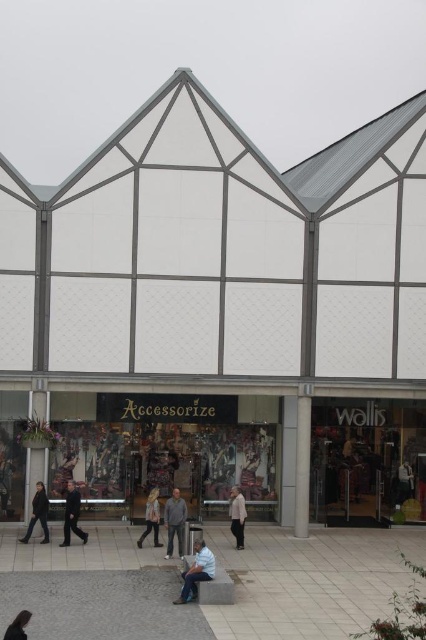
Question: Which point is closer to the camera?

Choices:
 (A) white matte mall at center
 (B) denim jeans at center
 (C) light brown leather jacket at center
 (D) gray cotton shirt at center

Answer: (B)

Question: Estimate the real-world distances between objects in this image. Which object is farther from the white matte mall at center?

Choices:
 (A) matte black clothing store at lower center
 (B) dark brown hair at upper left
 (C) dark brown leather jacket at lower left

Answer: (B)

Question: Can you confirm if matte black clothing store at lower center is wider than light brown leather jacket at center?

Choices:
 (A) no
 (B) yes

Answer: (B)

Question: Which point appears farthest from the camera in this image?

Choices:
 (A) (393, 429)
 (B) (157, 502)
 (C) (17, 621)
 (D) (166, 509)

Answer: (A)

Question: Is matte black clothing store at lower center positioned at the back of dark brown hair at upper left?

Choices:
 (A) yes
 (B) no

Answer: (A)

Question: From the image, what is the correct spatial relationship of light brown leather jacket at center in relation to dark brown hair at upper left?

Choices:
 (A) above
 (B) below

Answer: (B)